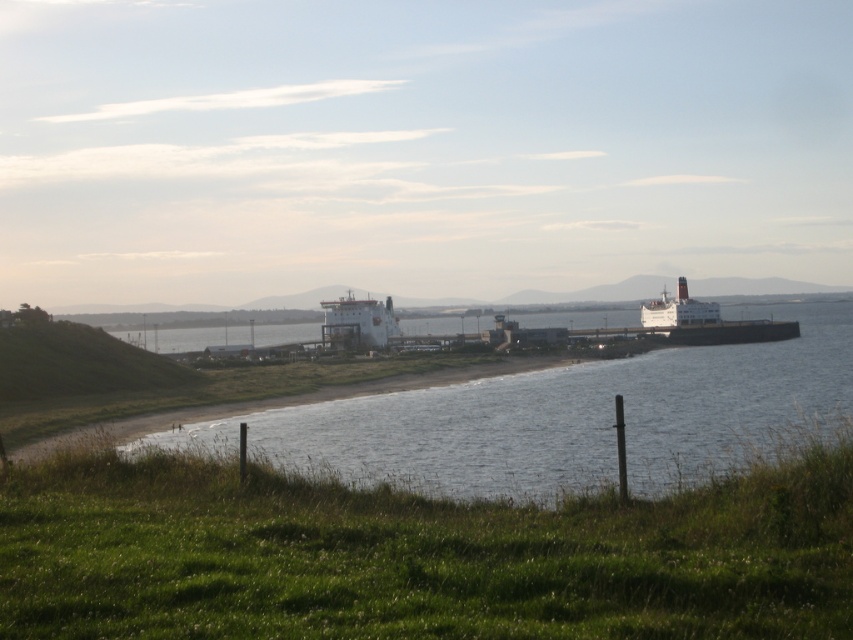
You are a photographer planning to take a wide shot of the coastal scene. You want to ensure both the clear water at center and the white matte ferry at upper right are visible in the frame. Based on their sizes, which object should you prioritize positioning closer to the center of your composition to maintain balance?

The clear water at center should be prioritized closer to the center of the composition because its width is larger than the white matte ferry at upper right, making it a more dominant element in the scene.

You are standing at the grassy area in the foreground of the coastal scene. You see two points marked in the image. Which point, point [18,554] or point [679,324], is closer to you?

Point [18,554] is closer to the viewer than point [679,324].